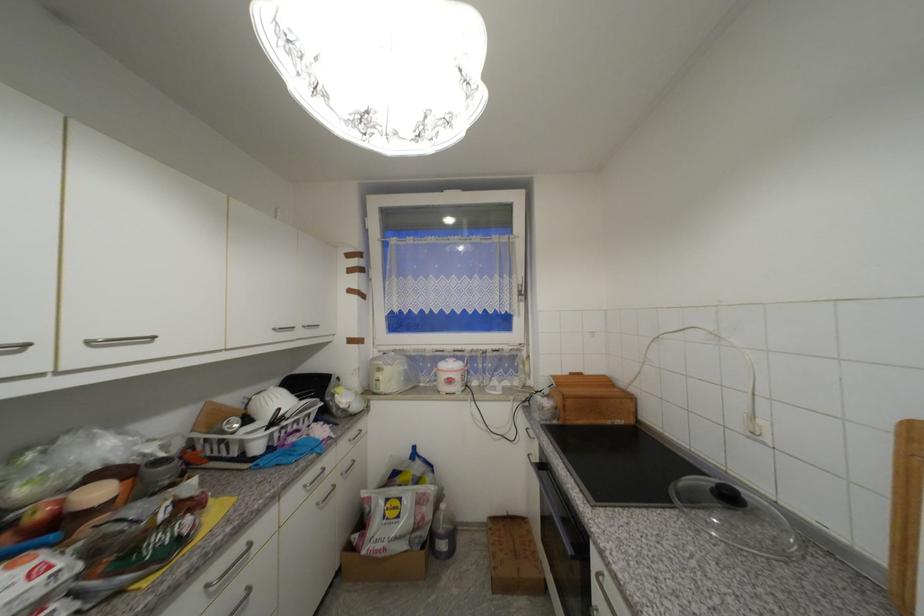
Describe the element at coordinates (736, 514) in the screenshot. I see `the black lid handle` at that location.